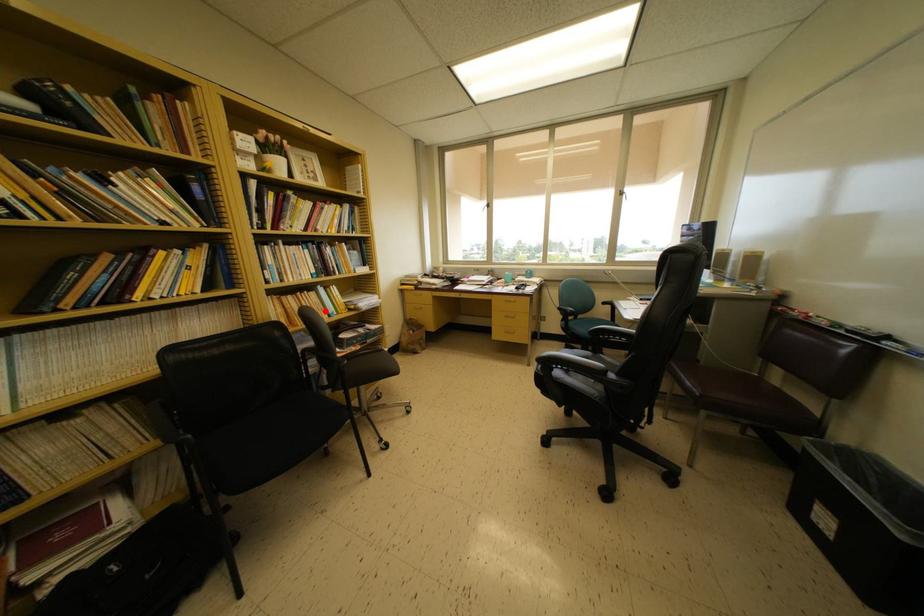
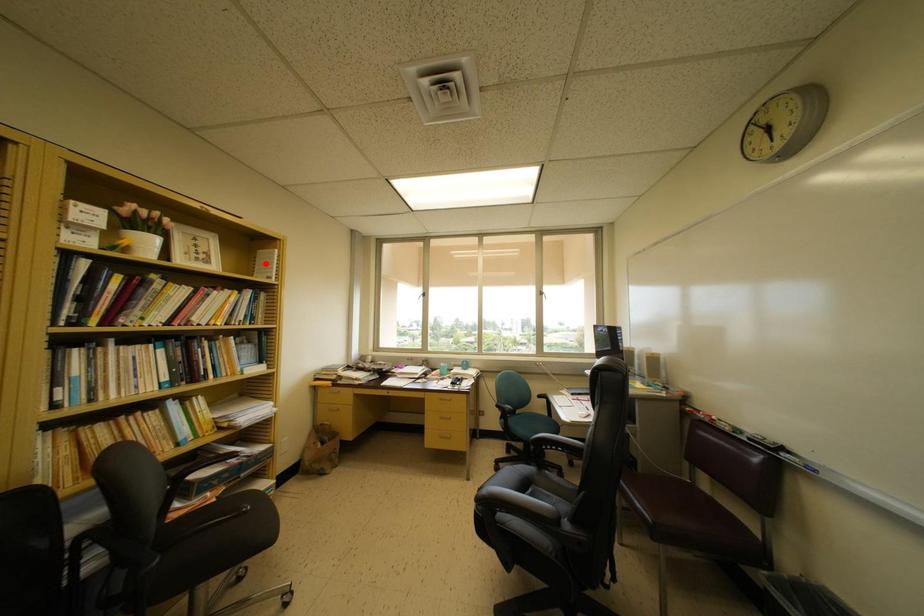
Consider the image. I am providing you with two images of the same scene from different viewpoints. A red point is marked on the first image and another point is marked on the second image. Is the marked point in image1 the same physical position as the marked point in image2?

No